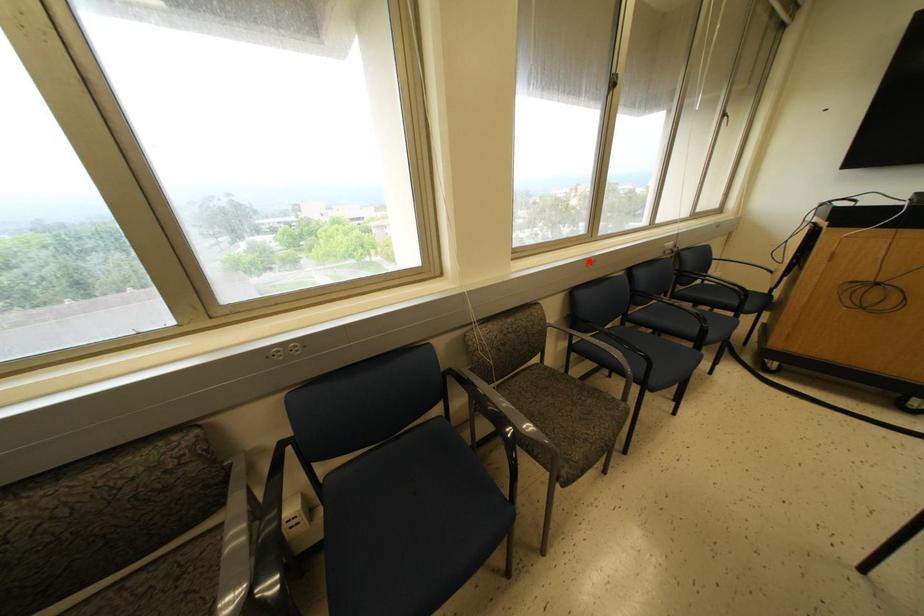
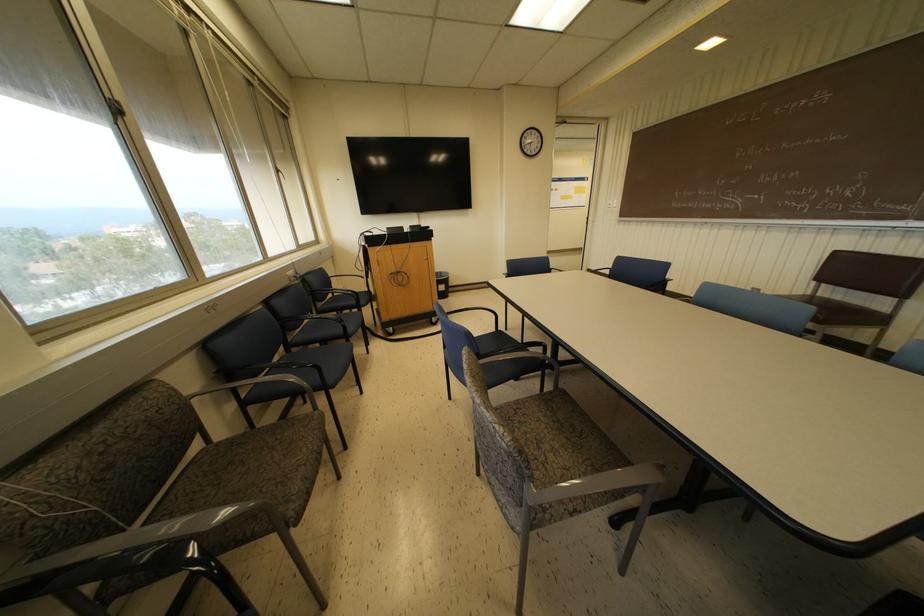
Question: I am providing you with two images of the same scene from different viewpoints. Given a red point in image1, look at the same physical point in image2. Is it:

Choices:
 (A) Closer to the viewpoint
 (B) Farther from the viewpoint

Answer: (B)